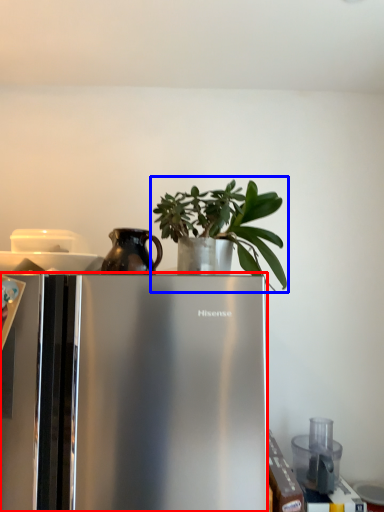
Question: Which object appears closest to the camera in this image, refrigerator (highlighted by a red box) or houseplant (highlighted by a blue box)?

Choices:
 (A) refrigerator
 (B) houseplant

Answer: (A)